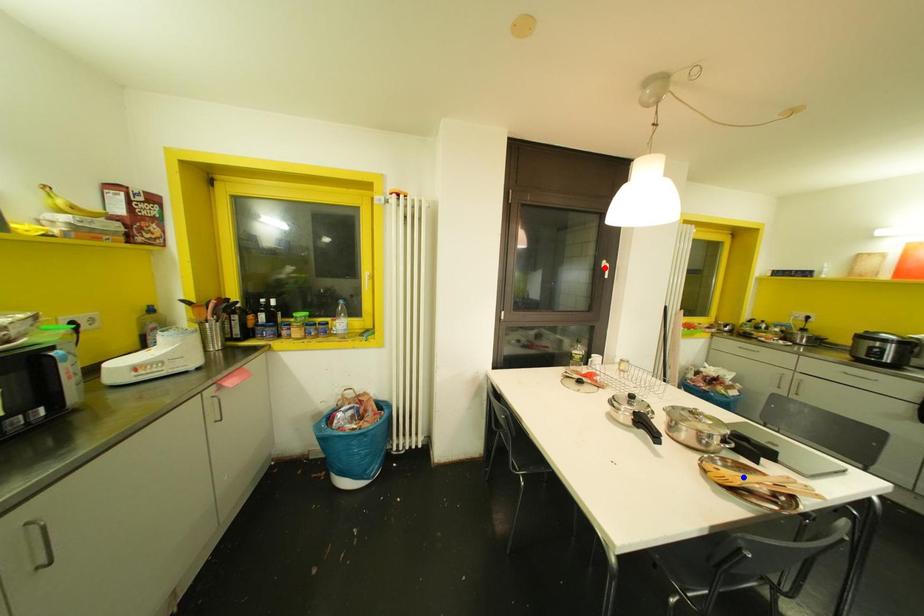
Question: Two points are marked on the image. Which point is closer to the camera?

Choices:
 (A) Blue point is closer.
 (B) Red point is closer.

Answer: (A)